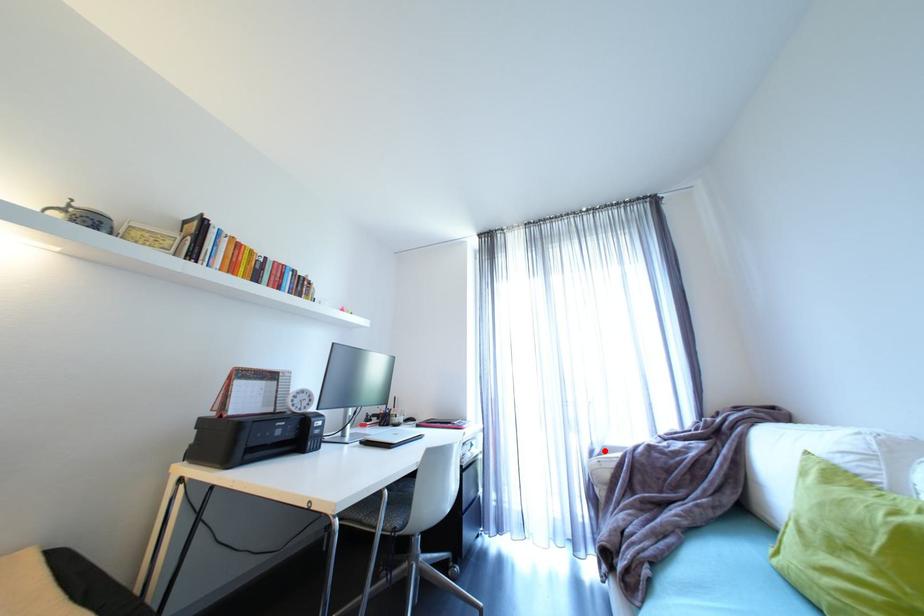
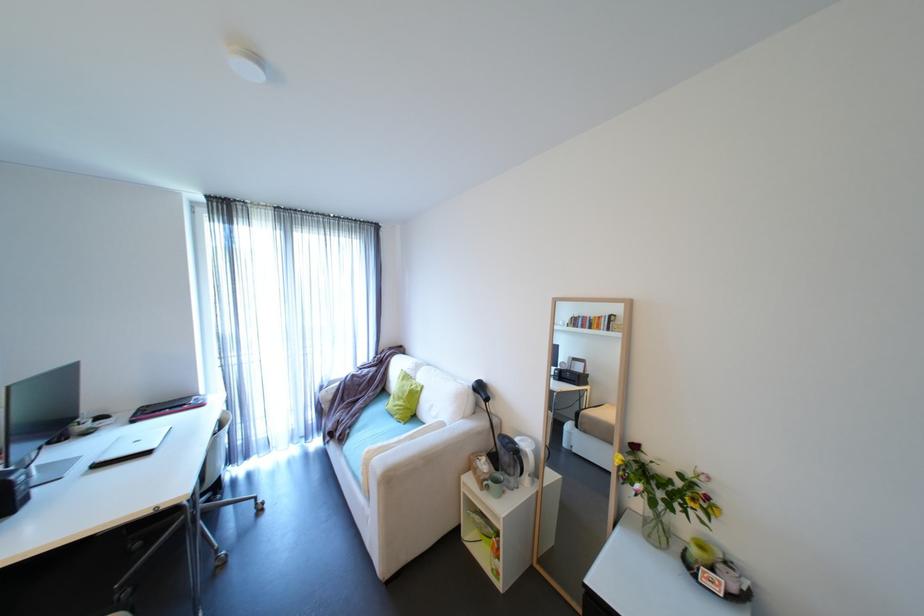
Find the pixel in the second image that matches the highlighted location in the first image.

(333, 386)